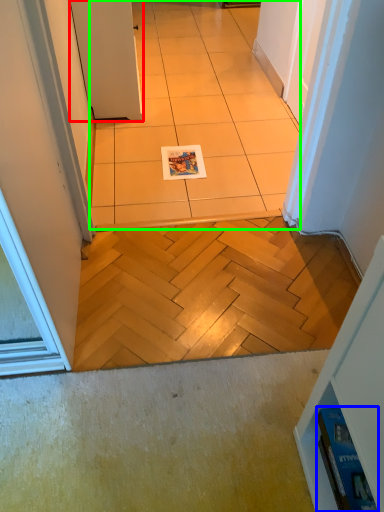
Question: Based on their relative distances, which object is farther from door (highlighted by a red box)? Choose from magazine (highlighted by a blue box) and ceramic tile (highlighted by a green box).

Choices:
 (A) magazine
 (B) ceramic tile

Answer: (A)